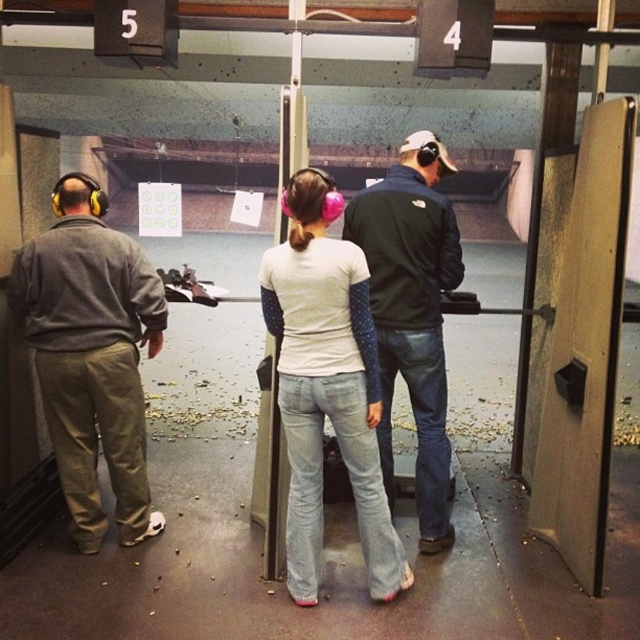
You are a safety inspector at the shooting range. You need to ensure that the matte gray hoodie at left and the dark blue jacket at center are positioned safely. Which individual is closer to you, the inspector, so you can address them first?

The matte gray hoodie at left is closer to you than the dark blue jacket at center, so you should address the person in the matte gray hoodie at left first.

You are a security guard at the shooting range. You need to locate the person wearing a matte gray hoodie at left. Where should you look?

The matte gray hoodie at left is located at point (92, 355).

You are a safety inspector checking the shooting range. You notice two people wearing jackets at the stations. The matte gray hoodie at left and the dark blue jacket at center. According to safety regulations, all jackets must be within a width limit of 40 cm to ensure proper movement. Can you determine if both jackets comply with the width requirement?

The matte gray hoodie at left is wider than the dark blue jacket at center. Since the width limit is 40 cm, both jackets must be individually measured. However, without specific measurements, it cannot be determined if either exceeds the limit. Further inspection is needed.